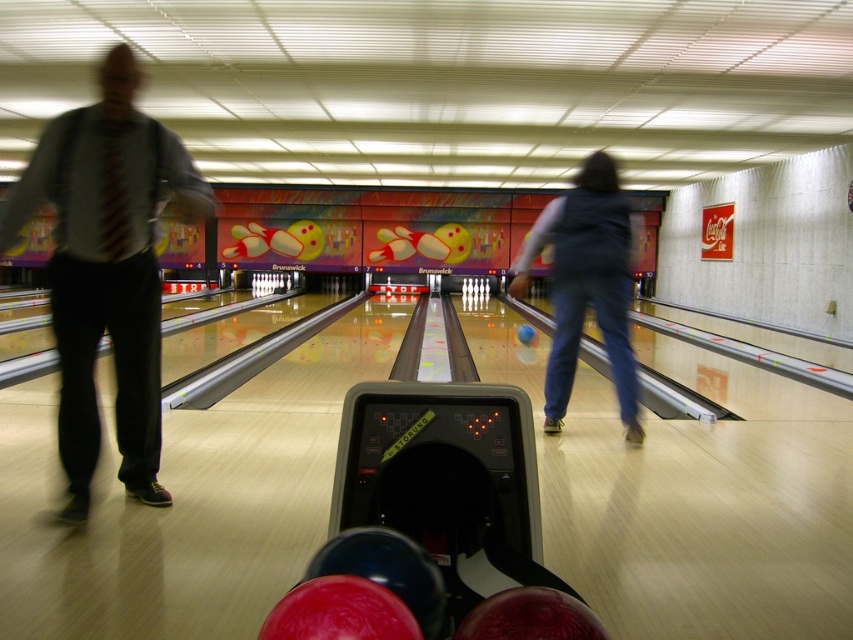
You are standing at the point with coordinates point [107,269]. What is the nearest object to you?

The nearest object to you at point [107,269] is the matte gray shirt at left.

You are a photographer trying to capture a clear shot of the matte gray shirt at left and the blue denim jeans at center. Since the scene is dynamic, you need to adjust your focus. Which object should you focus on first to ensure clarity, considering their sizes?

The matte gray shirt at left is larger in size than the blue denim jeans at center, so focusing on the matte gray shirt at left first would ensure clarity due to its larger size.

You are a customer at the bowling alley and see the matte gray shirt at left and the blue denim jeans at center. Which clothing item is positioned lower in the image?

The matte gray shirt at left is positioned below the blue denim jeans at center, so it is lower in the image.